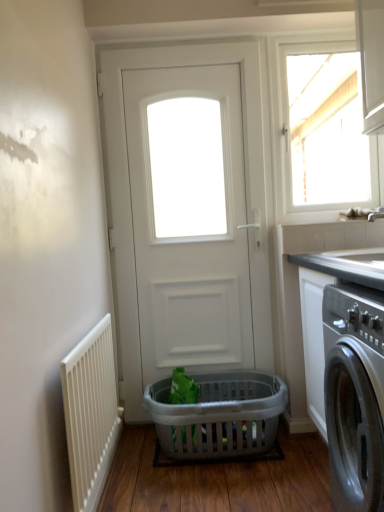
Question: Can we say white matte door at center lies outside white plastic radiator at lower left?

Choices:
 (A) yes
 (B) no

Answer: (A)

Question: From a real-world perspective, is white matte door at center beneath white plastic radiator at lower left?

Choices:
 (A) no
 (B) yes

Answer: (A)

Question: Is white matte door at center smaller than white plastic radiator at lower left?

Choices:
 (A) yes
 (B) no

Answer: (B)

Question: Is white matte door at center not close to white plastic radiator at lower left?

Choices:
 (A) yes
 (B) no

Answer: (B)

Question: Can you confirm if white matte door at center is positioned to the left of white plastic radiator at lower left?

Choices:
 (A) no
 (B) yes

Answer: (A)

Question: Looking at the image, does white glossy window at upper right seem bigger or smaller compared to translucent plastic basket at lower center?

Choices:
 (A) big
 (B) small

Answer: (B)

Question: From the image's perspective, is white glossy window at upper right positioned above or below translucent plastic basket at lower center?

Choices:
 (A) below
 (B) above

Answer: (B)

Question: Is white glossy window at upper right in front of or behind translucent plastic basket at lower center in the image?

Choices:
 (A) front
 (B) behind

Answer: (B)

Question: Would you say white glossy window at upper right is to the left or to the right of translucent plastic basket at lower center in the picture?

Choices:
 (A) left
 (B) right

Answer: (B)

Question: Considering the positions of white matte door at center and translucent plastic basket at lower center in the image, is white matte door at center bigger or smaller than translucent plastic basket at lower center?

Choices:
 (A) big
 (B) small

Answer: (A)

Question: Do you think white matte door at center is within translucent plastic basket at lower center, or outside of it?

Choices:
 (A) inside
 (B) outside

Answer: (B)

Question: From the image's perspective, relative to translucent plastic basket at lower center, is white matte door at center above or below?

Choices:
 (A) above
 (B) below

Answer: (A)

Question: From a real-world perspective, is white matte door at center physically located above or below translucent plastic basket at lower center?

Choices:
 (A) below
 (B) above

Answer: (B)

Question: Is point (243, 433) closer or farther from the camera than point (160, 66)?

Choices:
 (A) farther
 (B) closer

Answer: (B)

Question: From a real-world perspective, is translucent plastic basket at lower center above or below white matte door at center?

Choices:
 (A) above
 (B) below

Answer: (B)